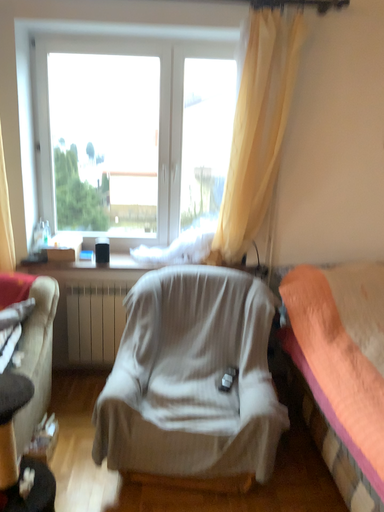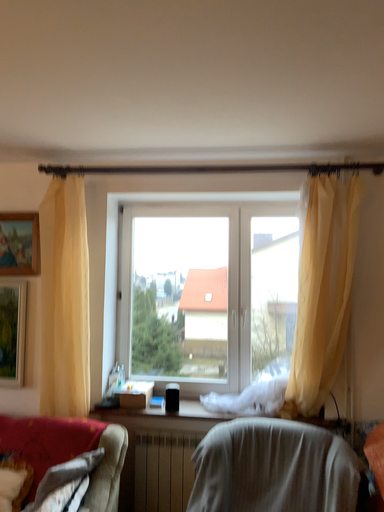
Question: How did the camera likely rotate when shooting the video?

Choices:
 (A) rotated upward
 (B) rotated downward

Answer: (A)